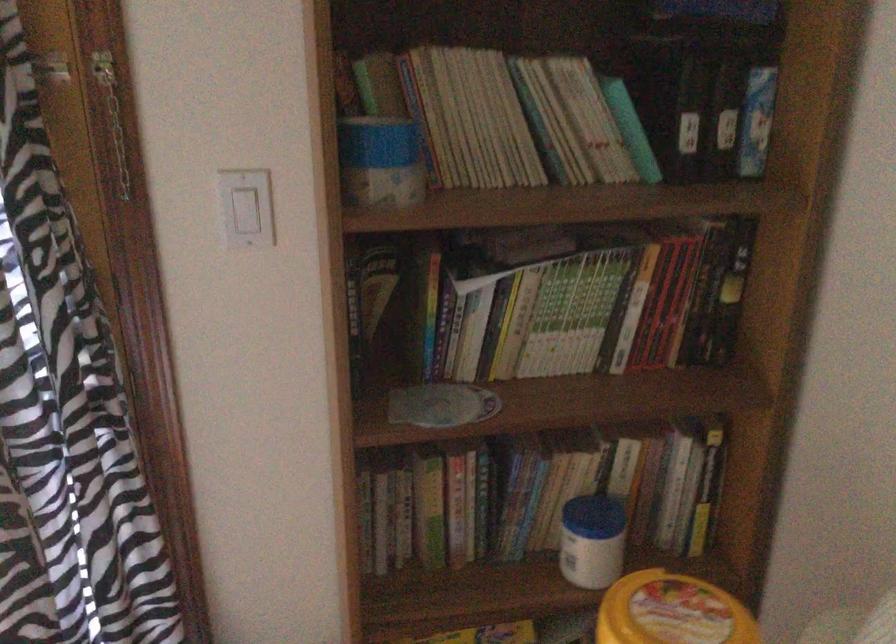
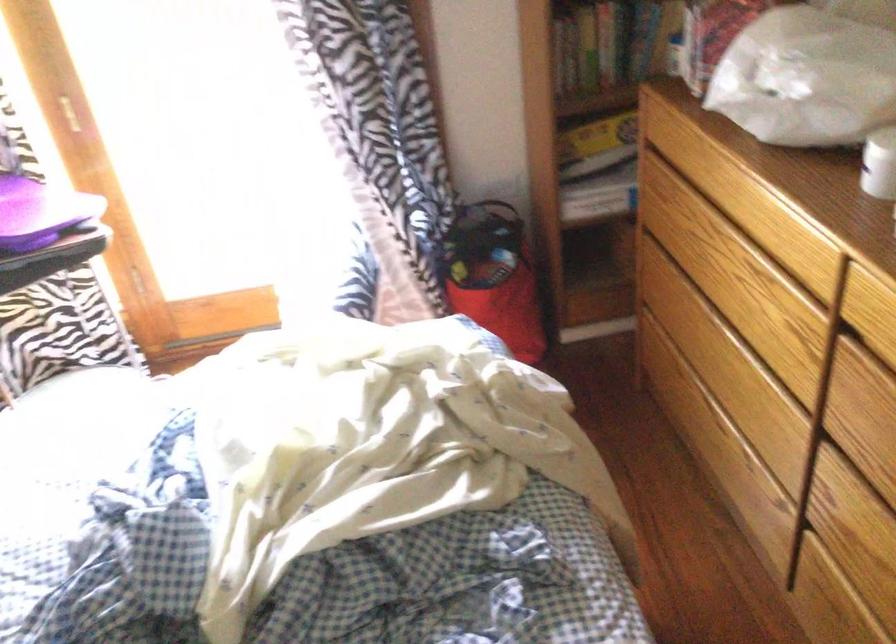
Where in the second image is the point corresponding to point (390, 543) from the first image?

(564, 58)